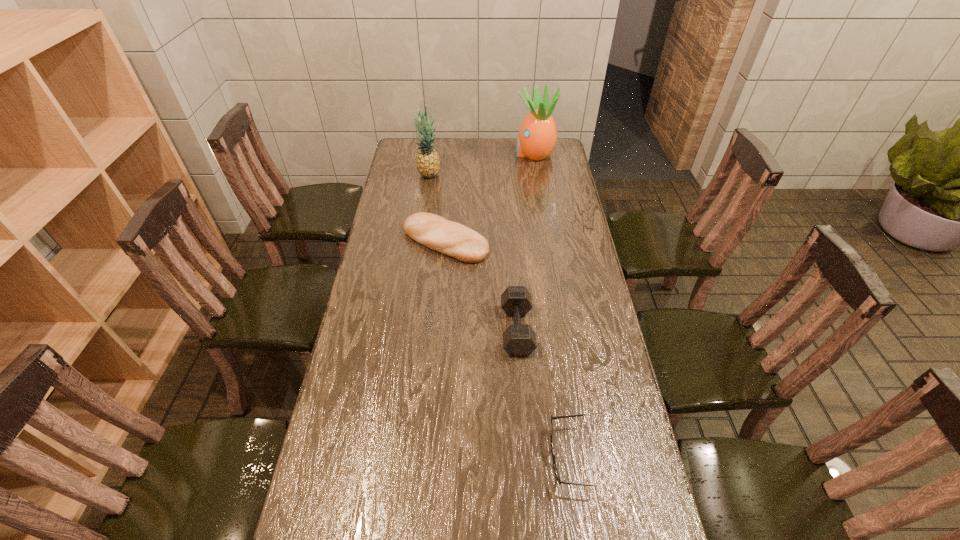
Locate an element on the screen. the farthest object is located at coordinates (537, 137).

I want to click on the farther pineapple, so click(x=537, y=137).

The height and width of the screenshot is (540, 960). Identify the location of the nearer pineapple. (428, 163).

The image size is (960, 540). In order to click on the left pineapple in this screenshot , I will do `click(428, 163)`.

At what (x,y) coordinates should I click in order to perform the action: click on the fourth farthest object. Please return your answer as a coordinate pair (x, y). This screenshot has height=540, width=960. Looking at the image, I should click on (519, 340).

What are the coordinates of `bread` in the screenshot? It's located at (450, 238).

I want to click on the nearest object, so click(x=557, y=417).

The image size is (960, 540). I want to click on spectacles, so click(x=557, y=417).

Where is `vacant space located at the entrance of the farther pineapple`? vacant space located at the entrance of the farther pineapple is located at coordinates (435, 153).

Find the location of a particular element. The width and height of the screenshot is (960, 540). vacant area located 0.380m at the entrance of the farther pineapple is located at coordinates (435, 153).